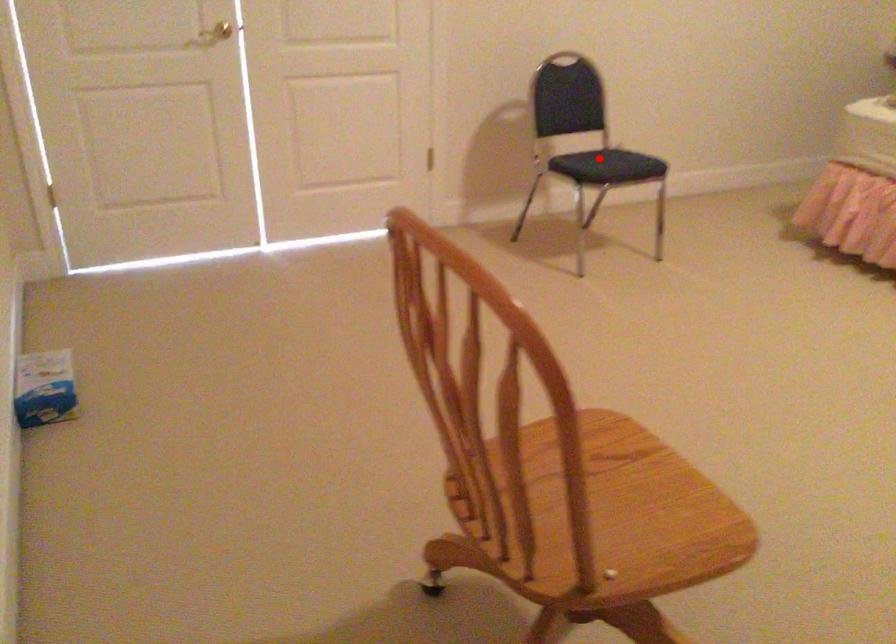
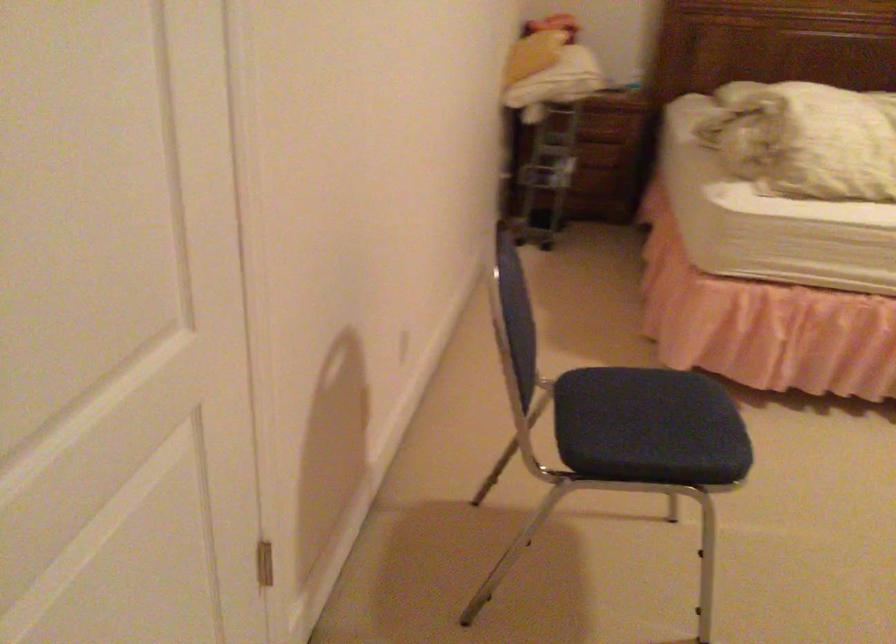
Question: I am providing you with two images of the same scene from different viewpoints. Given a red point in image1, look at the same physical point in image2. Is it:

Choices:
 (A) Closer to the viewpoint
 (B) Farther from the viewpoint

Answer: (A)